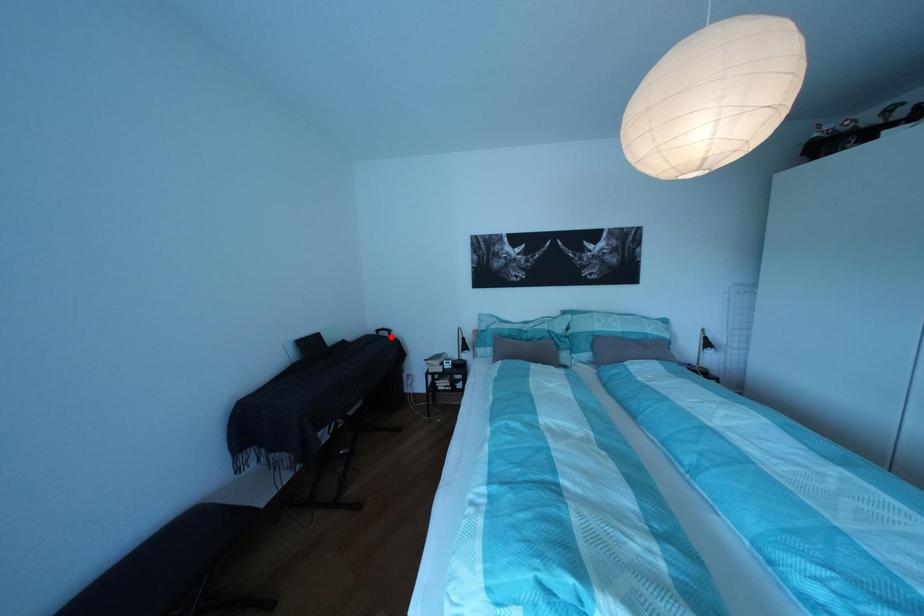
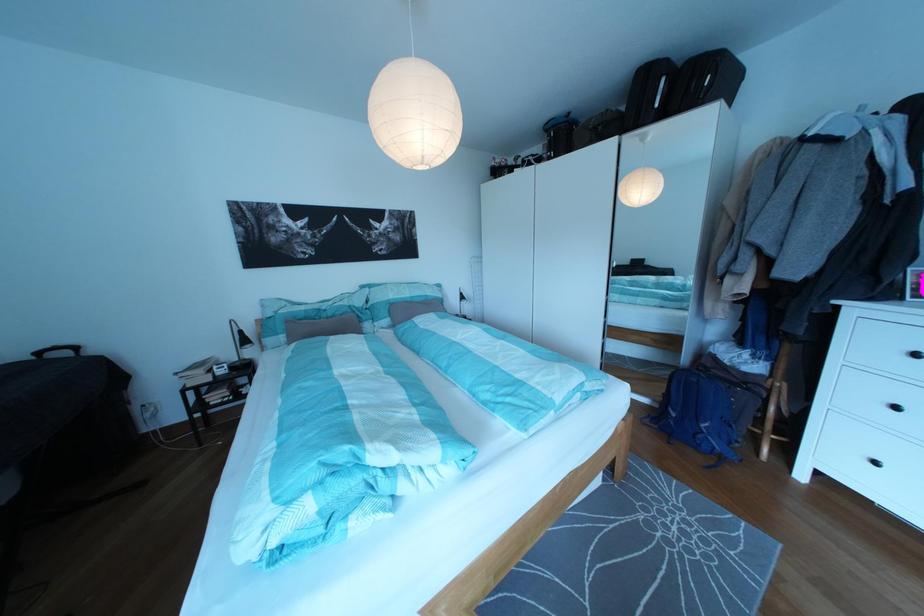
Where in the second image is the point corresponding to the highlighted location from the first image?

(53, 360)